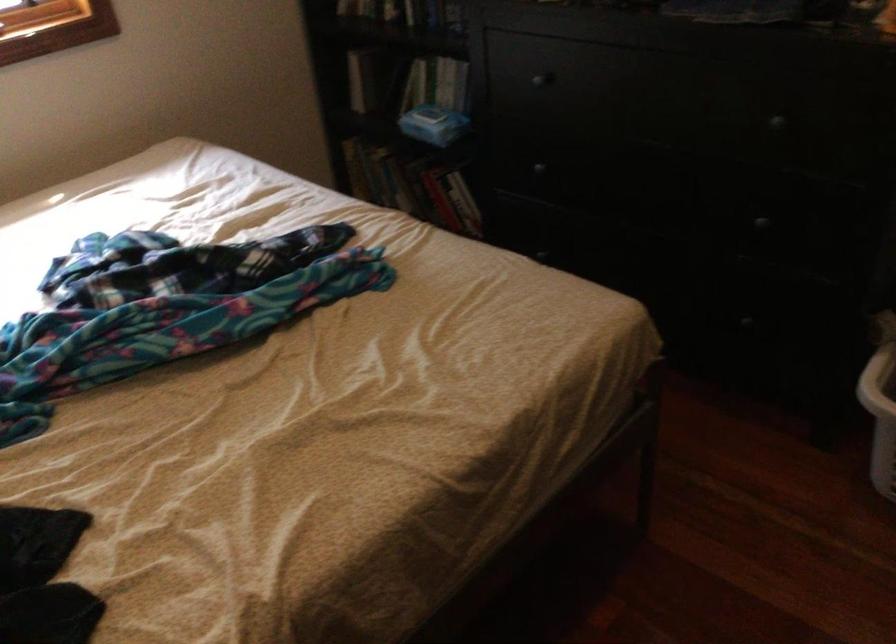
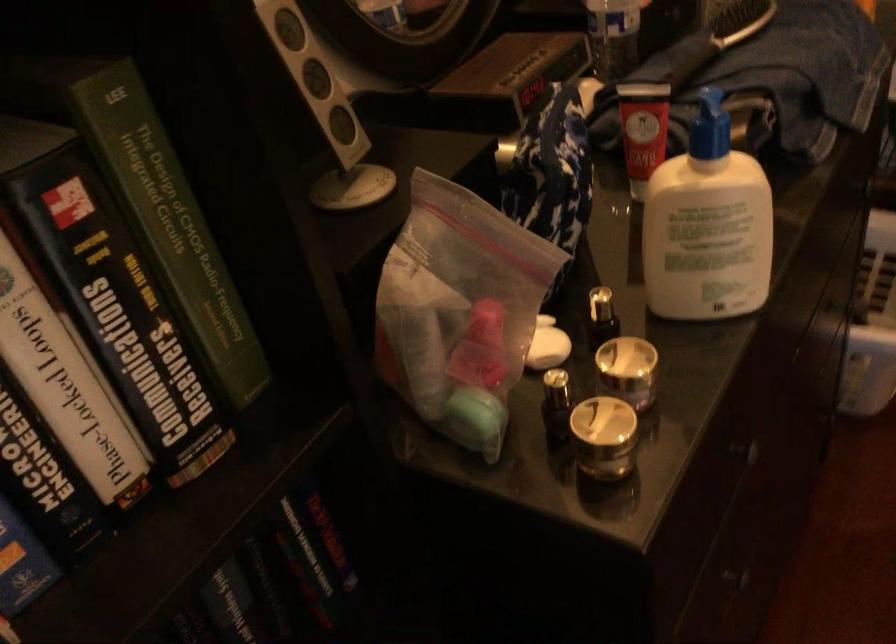
Find the pixel in the second image that matches [550,82] in the first image.

(756, 451)